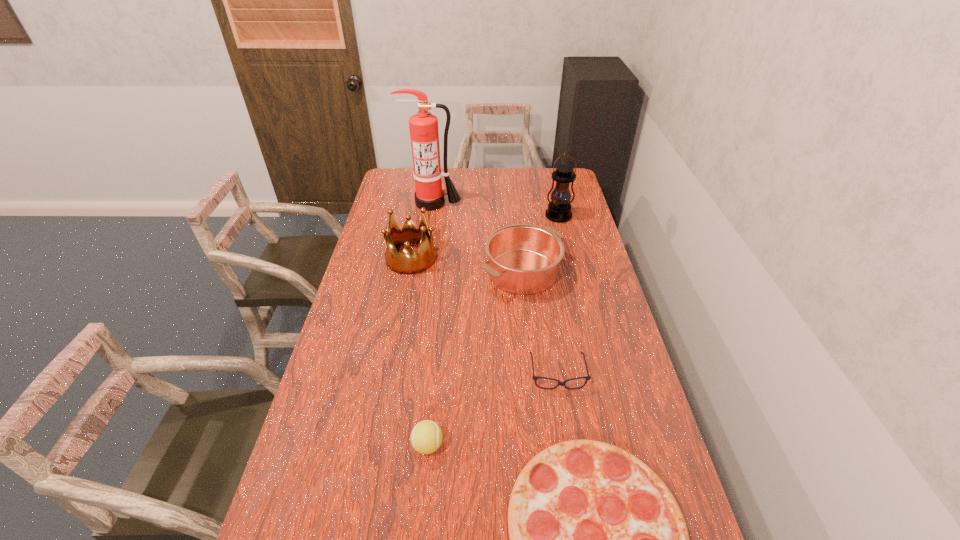
Image resolution: width=960 pixels, height=540 pixels. I want to click on fire extinguisher, so click(424, 134).

Locate an element on the screen. the second tallest object is located at coordinates (x=559, y=209).

The image size is (960, 540). In order to click on the fifth shortest object in this screenshot , I will do click(408, 262).

Locate an element on the screen. Image resolution: width=960 pixels, height=540 pixels. the fourth tallest object is located at coordinates (524, 259).

Where is `the third shortest object`? the third shortest object is located at coordinates pos(426,437).

Where is `spectacles`? Image resolution: width=960 pixels, height=540 pixels. spectacles is located at coordinates (534, 377).

The height and width of the screenshot is (540, 960). I want to click on the second shortest object, so click(x=534, y=377).

I want to click on vacant position located at the nozzle of the fire extinguisher, so click(x=422, y=268).

Find several locations within the vacant space located 0.380m above the lantern, indicating its light source. Please provide its 2D coordinates. Your answer should be formatted as a tuple, i.e. [(x, y)], where the tuple contains the x and y coordinates of a point satisfying the conditions above.

[(575, 284)]

Find the location of a particular element. The width and height of the screenshot is (960, 540). blank space located on the right of the third tallest object is located at coordinates (477, 258).